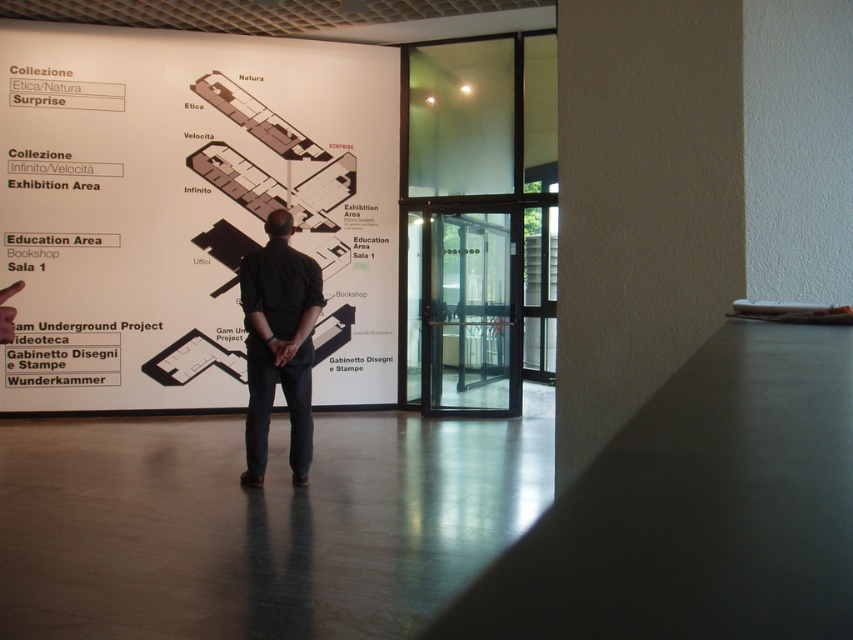
Question: Which point appears closest to the camera in this image?

Choices:
 (A) (15, 104)
 (B) (294, 253)

Answer: (B)

Question: In this image, where is white paper at upper left located relative to black cotton shirt at center?

Choices:
 (A) right
 (B) left

Answer: (B)

Question: Which point appears closest to the camera in this image?

Choices:
 (A) (129, 60)
 (B) (303, 316)

Answer: (B)

Question: Which point is farther from the camera taking this photo?

Choices:
 (A) (289, 385)
 (B) (115, 84)

Answer: (B)

Question: Is white paper at upper left bigger than black cotton shirt at center?

Choices:
 (A) no
 (B) yes

Answer: (B)

Question: Is the position of white paper at upper left less distant than that of black cotton shirt at center?

Choices:
 (A) no
 (B) yes

Answer: (A)